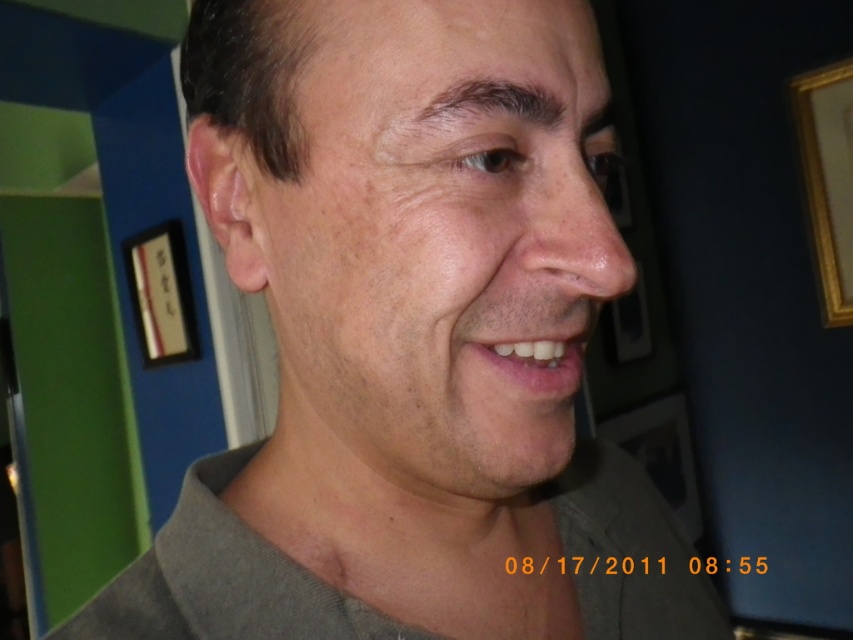
In the scene shown: You are a photographer adjusting the focus on your camera. You want to ensure both the smooth skin face at center and the white glossy teeth at center are in focus. Given that the depth of field can only sharply focus on one object at a time, which object should you prioritize focusing on to ensure the most important feature is clear?

The smooth skin face at center should be prioritized for focus since its width surpasses that of the white glossy teeth at center, making it the dominant feature in the composition.

You are a photographer adjusting the lighting in the room. You notice the gold metallic picture frame at upper right and the white glossy teeth at center. Which object would cast a wider shadow based on their sizes?

The gold metallic picture frame at upper right would cast a wider shadow since its width is larger than the white glossy teeth at center.

You are a photographer adjusting lighting for a portrait. You notice the gold metallic picture frame at upper right and the white glossy teeth at center. Which object might cause more glare under bright light, and why?

The gold metallic picture frame at upper right is more likely to cause glare under bright light because metallic surfaces typically reflect light more intensely than the white glossy teeth at center.